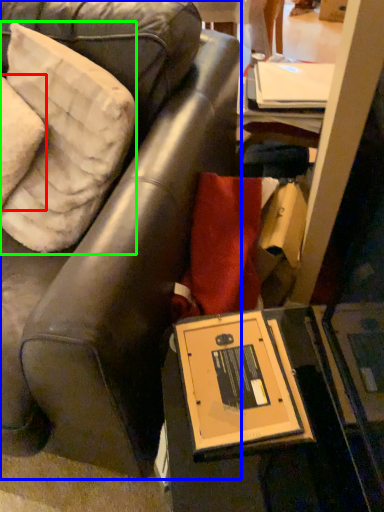
Question: Estimate the real-world distances between objects in this image. Which object is closer to pillow (highlighted by a red box), chair (highlighted by a blue box) or pillow (highlighted by a green box)?

Choices:
 (A) chair
 (B) pillow

Answer: (B)